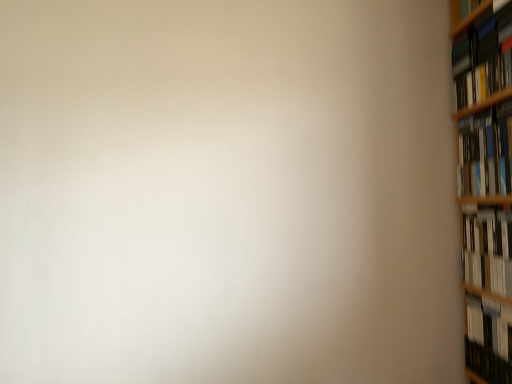
Question: Looking at the image, does hardcover book at right, the third book positioned from the bottom, seem bigger or smaller compared to hardcover book at right, which appears as the 1th book when ordered from the bottom?

Choices:
 (A) small
 (B) big

Answer: (B)

Question: In terms of width, does hardcover book at right, the 2th book when ordered from top to bottom, look wider or thinner when compared to hardcover book at right, which appears as the 1th book when ordered from the bottom?

Choices:
 (A) wide
 (B) thin

Answer: (A)

Question: Estimate the real-world distances between objects in this image. Which object is farther from the hardcover book at right, the third book positioned from the bottom?

Choices:
 (A) hardcover book at right, which appears as the 1th book when ordered from the bottom
 (B) hardcover book at upper right, marked as the first book in a top-to-bottom arrangement
 (C) white glossy book at right, positioned as the second book in bottom-to-top order

Answer: (A)

Question: Which of these objects is positioned farthest from the hardcover book at upper right, marked as the first book in a top-to-bottom arrangement?

Choices:
 (A) white glossy book at right, positioned as the second book in bottom-to-top order
 (B) hardcover book at right, the fourth book from the top
 (C) hardcover book at right, the 2th book when ordered from top to bottom

Answer: (B)